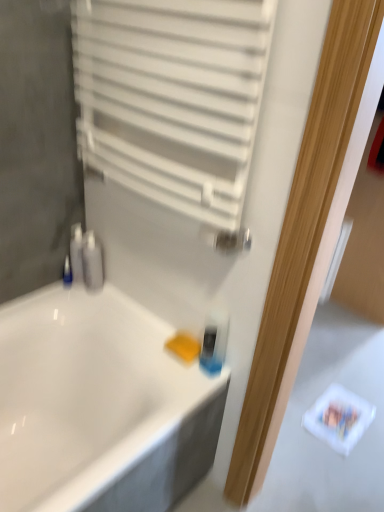
The height and width of the screenshot is (512, 384). I want to click on free space to the left of yellow sponge at lower center, so click(145, 344).